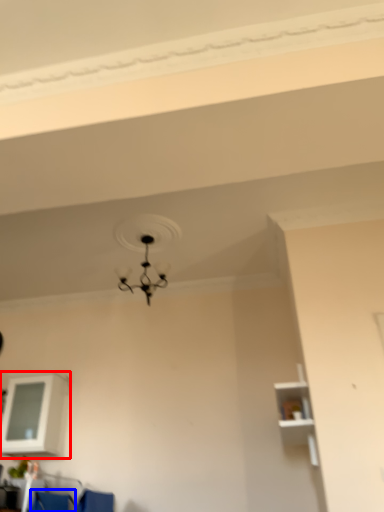
Question: Which object is closer to the camera taking this photo, shelf (highlighted by a red box) or armchair (highlighted by a blue box)?

Choices:
 (A) shelf
 (B) armchair

Answer: (B)